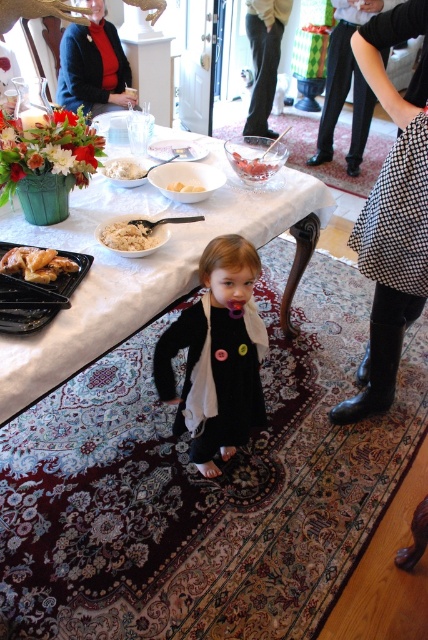
You are a guest at the event and you want to sit down at the table. You see the black houndstooth skirt at lower right and the white creamy rice at center. Which object is taller so you can avoid tripping over it?

The black houndstooth skirt at lower right is taller than the white creamy rice at center, so you should avoid tripping over the black houndstooth skirt at lower right.

You are a guest at the event and want to find the black matte dress at center. According to the coordinates provided, where should you look?

The black matte dress at center is located at point [216,355].